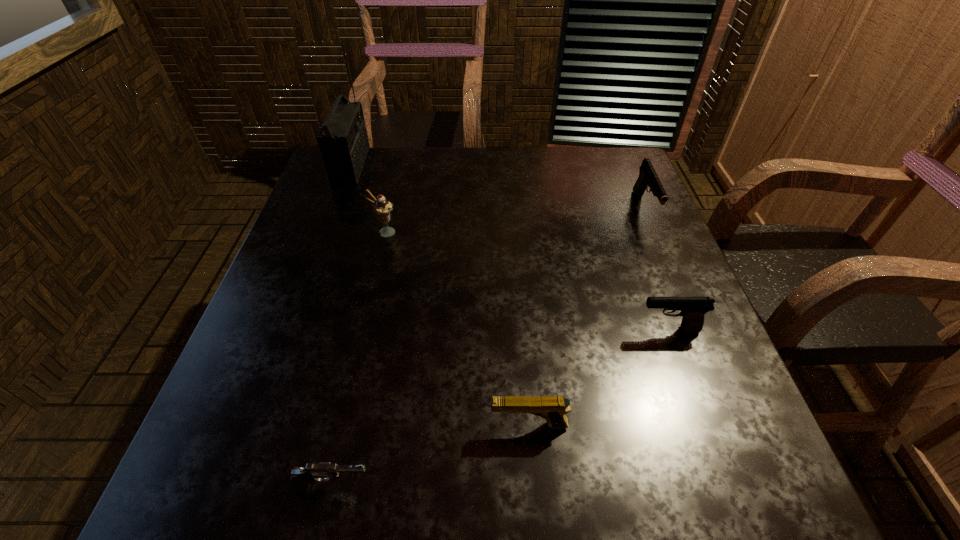
Find the location of a particular element. object that is the third closest to the tallest object is located at coordinates (552, 408).

Identify the location of object that is the fifth closest to the third pistol from right to left. This screenshot has height=540, width=960. (343, 141).

Where is `pistol that is the second closest to the radio receiver`? The image size is (960, 540). pistol that is the second closest to the radio receiver is located at coordinates (552, 408).

Where is `pistol that is the closest to the nearest pistol`? pistol that is the closest to the nearest pistol is located at coordinates (552, 408).

This screenshot has height=540, width=960. What are the coordinates of `free space that satisfies the following two spatial constraints: 1. at the muzzle of the farthest pistol; 2. at the barrel of the nearest object` in the screenshot? It's located at click(760, 486).

The image size is (960, 540). I want to click on free space that satisfies the following two spatial constraints: 1. at the muzzle of the farthest pistol; 2. at the barrel of the leftmost pistol, so click(x=760, y=486).

This screenshot has height=540, width=960. In order to click on blank space that satisfies the following two spatial constraints: 1. on the front panel of the icecream; 2. on the left side of the tallest object in this screenshot , I will do `click(326, 232)`.

Find the location of `blank area in the image that satisfies the following two spatial constraints: 1. at the muzzle of the farthest pistol; 2. at the barrel of the third pistol from right to left`. blank area in the image that satisfies the following two spatial constraints: 1. at the muzzle of the farthest pistol; 2. at the barrel of the third pistol from right to left is located at coordinates (734, 425).

The height and width of the screenshot is (540, 960). I want to click on free location that satisfies the following two spatial constraints: 1. at the muzzle of the farthest pistol; 2. at the barrel of the second nearest object, so click(734, 425).